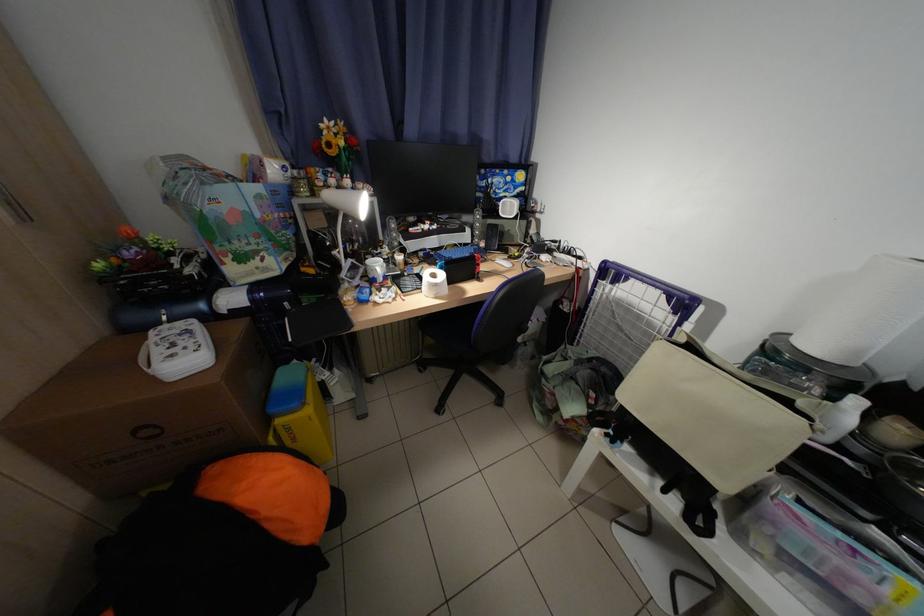
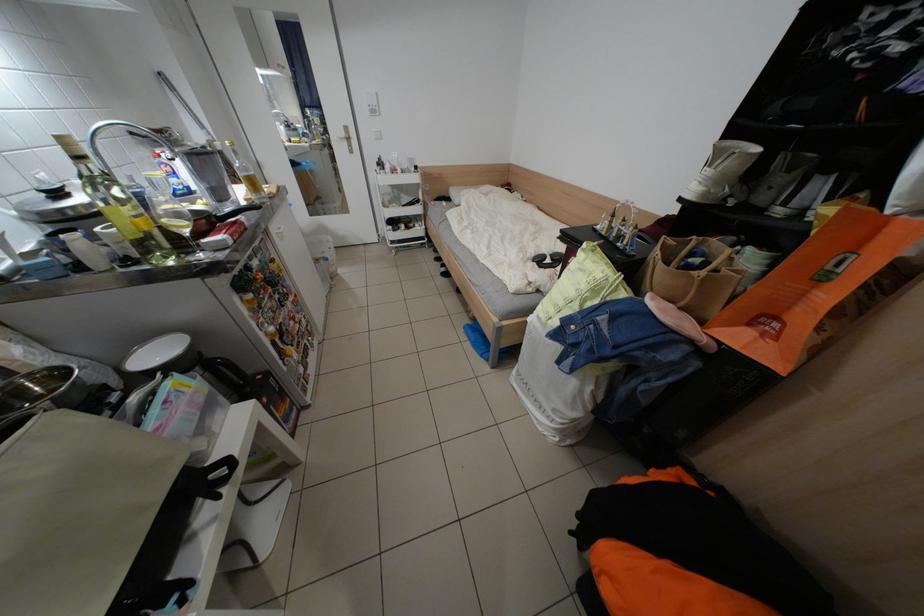
Find the pixel in the second image that matches point 721,535 in the first image.

(238, 463)